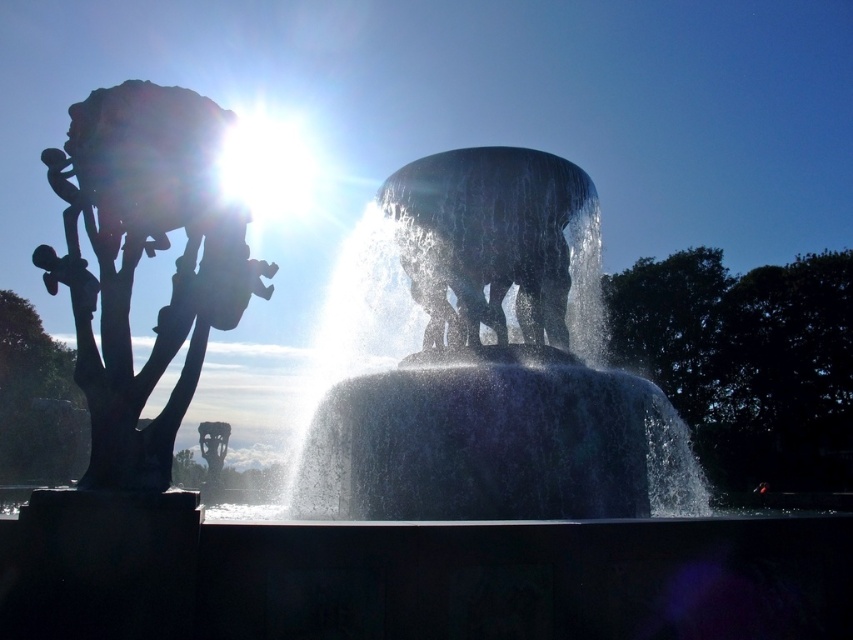
Question: Which point appears farthest from the camera in this image?

Choices:
 (A) (753, 296)
 (B) (84, 337)
 (C) (74, 420)
 (D) (398, 401)

Answer: (A)

Question: Can you confirm if black matte tree at left is positioned below matte gray tree at left?

Choices:
 (A) no
 (B) yes

Answer: (A)

Question: Is green leafy tree at center further to camera compared to glossy stone elephant at center?

Choices:
 (A) yes
 (B) no

Answer: (A)

Question: From the image, what is the correct spatial relationship of translucent glass water at center in relation to green leafy tree at center?

Choices:
 (A) above
 (B) below

Answer: (A)

Question: Which of these objects is positioned closest to the translucent glass water at center?

Choices:
 (A) glossy stone elephant at center
 (B) green leafy tree at center
 (C) black matte tree at left

Answer: (A)

Question: Based on their relative distances, which object is farther from the green leafy tree at center?

Choices:
 (A) glossy stone elephant at center
 (B) matte gray tree at left
 (C) translucent glass water at center

Answer: (B)